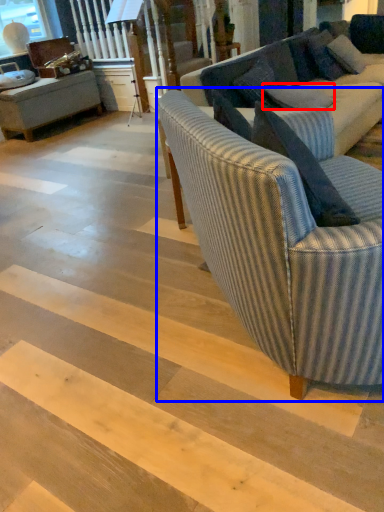
Question: Which object appears farthest to the camera in this image, pillow (highlighted by a red box) or studio couch (highlighted by a blue box)?

Choices:
 (A) pillow
 (B) studio couch

Answer: (A)